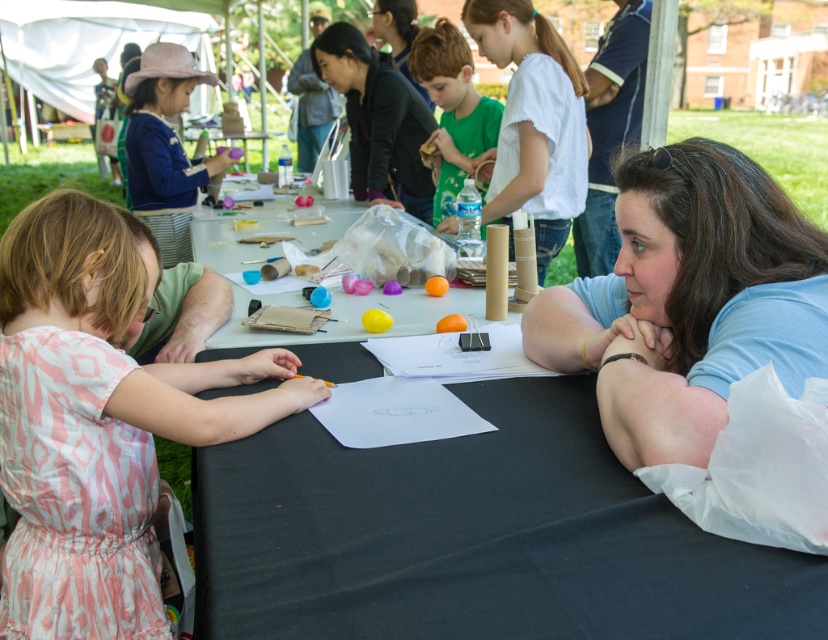
You are standing at the edge of the craft table and want to pick up an item. There are two points marked on the table where items are placed. Which point is closer to you, point (588, 324) or point (537, 257)?

Point (588, 324) is closer to you than point (537, 257).

You are standing at the entrance of the tent and want to locate the pink fabric hat at upper left. According to the coordinates provided, where should you look relative to the center of the image?

The pink fabric hat at upper left is located at coordinates point (165, 147), which means it is positioned to the left and slightly below the center of the image.